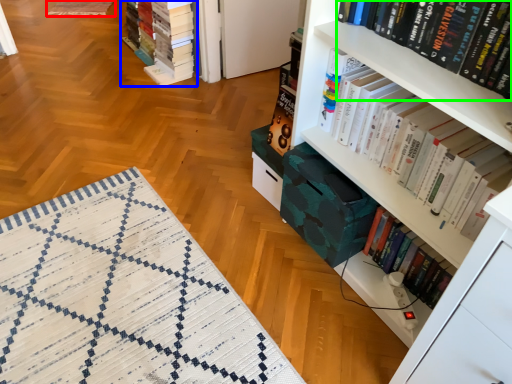
Question: Estimate the real-world distances between objects in this image. Which object is farther from quilt (highlighted by a red box), book (highlighted by a blue box) or book (highlighted by a green box)?

Choices:
 (A) book
 (B) book

Answer: (B)